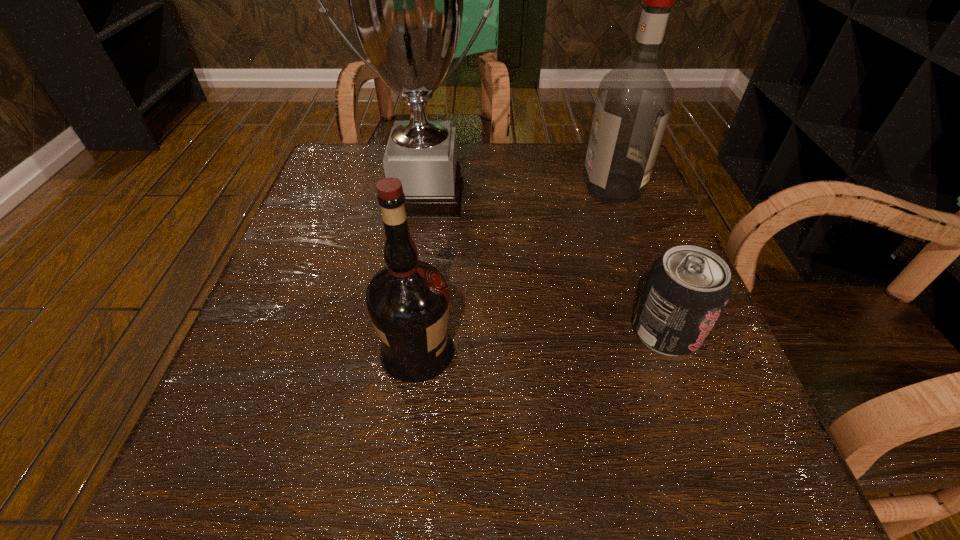
Locate an element on the screen. The height and width of the screenshot is (540, 960). trophy cup is located at coordinates (405, 0).

This screenshot has height=540, width=960. In order to click on the taller liquor in this screenshot , I will do `click(634, 101)`.

What are the coordinates of `the second tallest object` in the screenshot? It's located at (634, 101).

Locate an element on the screen. the nearer liquor is located at coordinates (408, 300).

The image size is (960, 540). Identify the location of the third tallest object. (408, 300).

In order to click on soda can in this screenshot , I will do `click(686, 290)`.

Find the location of a particular element. vacant space located 0.220m at the front view of the tallest object is located at coordinates (409, 310).

Where is `vacant space situated 0.320m on the front-facing side of the second tallest object`? This screenshot has width=960, height=540. vacant space situated 0.320m on the front-facing side of the second tallest object is located at coordinates (438, 187).

Where is `free point located 0.390m on the front-facing side of the second tallest object`? Image resolution: width=960 pixels, height=540 pixels. free point located 0.390m on the front-facing side of the second tallest object is located at coordinates (406, 187).

Locate an element on the screen. vacant region located 0.150m on the front-facing side of the second tallest object is located at coordinates (516, 187).